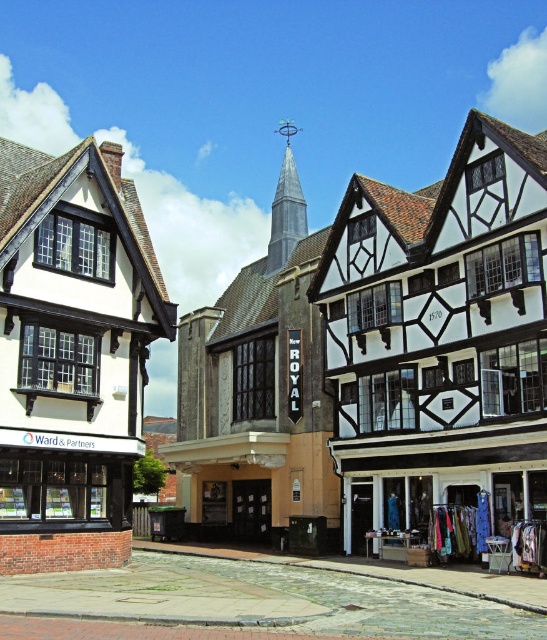
Looking at this image, you are standing on a historic street and want to take a photo of both point at position (482, 333) and point at position (538, 545). Which point should you focus on first to ensure both are in the frame?

You should focus on point at position (482, 333) first because it is closer to you than point at position (538, 545), ensuring both points are within the camera frame.